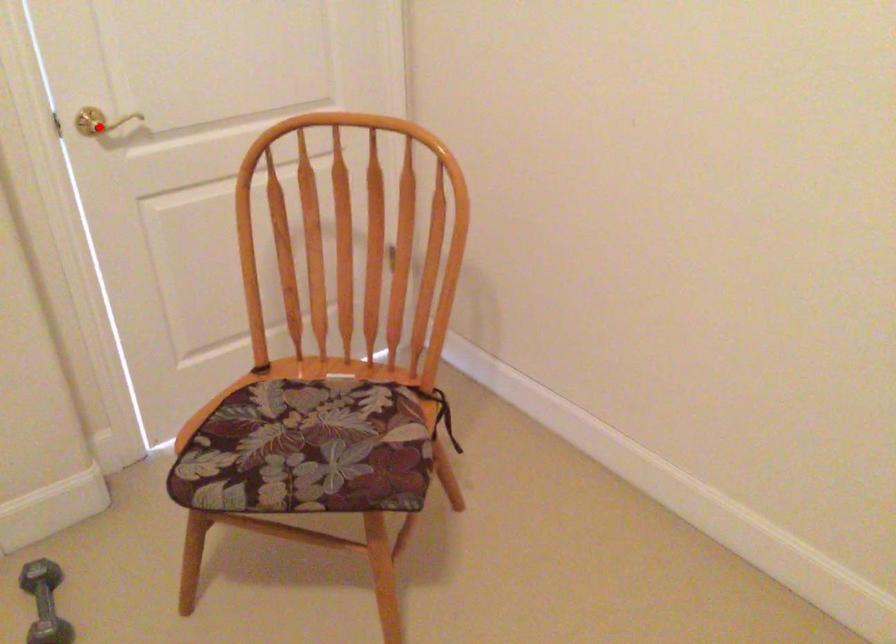
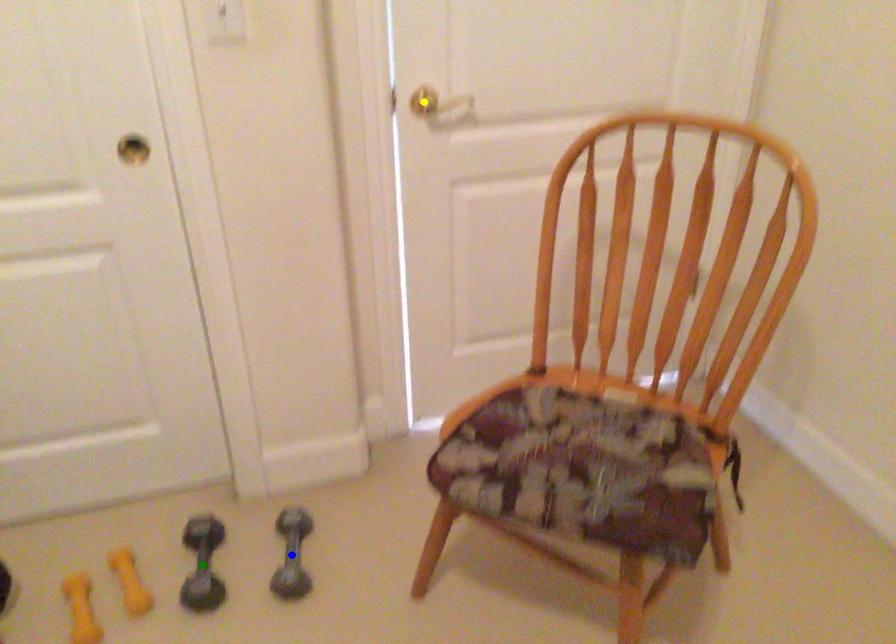
Question: I am providing you with two images of the same scene from different viewpoints. A red point is marked on the first image. You are given multiple points on the second image. Which spot in image 2 lines up with the point in image 1?

Choices:
 (A) green point
 (B) blue point
 (C) yellow point

Answer: (C)